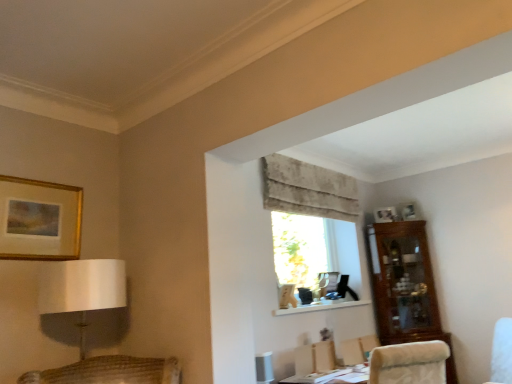
At what (x,y) coordinates should I click in order to perform the action: click on matte silver picture frame at upper right, marked as the 2th picture frame in a front-to-back arrangement. Please return your answer as a coordinate pair (x, y). This screenshot has height=384, width=512. Looking at the image, I should click on (385, 214).

Locate an element on the screen. The height and width of the screenshot is (384, 512). translucent fabric window at center is located at coordinates (298, 249).

This screenshot has height=384, width=512. What are the coordinates of `white glossy picture frame at upper right, the first picture frame positioned from the back` in the screenshot? It's located at (407, 211).

At what (x,y) coordinates should I click in order to perform the action: click on matte silver picture frame at upper right, marked as the 2th picture frame in a front-to-back arrangement. Please return your answer as a coordinate pair (x, y). Looking at the image, I should click on (385, 214).

Which is more to the left, velvet beige armchair at lower right or translucent fabric window at center?

From the viewer's perspective, translucent fabric window at center appears more on the left side.

Can you confirm if velvet beige armchair at lower right is smaller than translucent fabric window at center?

Yes.

Can you confirm if velvet beige armchair at lower right is wider than translucent fabric window at center?

Incorrect, the width of velvet beige armchair at lower right does not surpass that of translucent fabric window at center.

Can translucent fabric window at center be found inside velvet beige armchair at lower right?

No, translucent fabric window at center is not surrounded by velvet beige armchair at lower right.

How different are the orientations of gold/glossy picture frame at upper left, marked as the 1th picture frame in a left-to-right arrangement, and matte silver picture frame at upper right, which ranks as the second picture frame in back-to-front order, in degrees?

39.9 degrees.

Which is closer to the camera, (19, 255) or (384, 222)?

The point (19, 255) is closer.

How much distance is there between gold/glossy picture frame at upper left, which is the third picture frame from right to left, and matte silver picture frame at upper right, arranged as the second picture frame when viewed from the left?

A distance of 9.36 feet exists between gold/glossy picture frame at upper left, which is the third picture frame from right to left, and matte silver picture frame at upper right, arranged as the second picture frame when viewed from the left.

From a real-world perspective, is gold/glossy picture frame at upper left, which appears as the 1th picture frame when viewed from the front, over matte silver picture frame at upper right, arranged as the second picture frame when viewed from the left?

Actually, gold/glossy picture frame at upper left, which appears as the 1th picture frame when viewed from the front, is physically below matte silver picture frame at upper right, arranged as the second picture frame when viewed from the left, in the real world.

Could you tell me if velvet beige armchair at lower right is facing beige textured curtain at upper center?

No, velvet beige armchair at lower right is not facing towards beige textured curtain at upper center.

From a real-world perspective, is velvet beige armchair at lower right positioned over beige textured curtain at upper center based on gravity?

No, from a real-world perspective, velvet beige armchair at lower right is not above beige textured curtain at upper center.

Is velvet beige armchair at lower right to the left of beige textured curtain at upper center from the viewer's perspective?

Incorrect, velvet beige armchair at lower right is not on the left side of beige textured curtain at upper center.

Where is `curtain above the velvet beige armchair at lower right (from a real-world perspective)`? Image resolution: width=512 pixels, height=384 pixels. curtain above the velvet beige armchair at lower right (from a real-world perspective) is located at coordinates (308, 189).

Based on the photo, considering the sizes of translucent fabric window at center and beige textured curtain at upper center in the image, is translucent fabric window at center wider or thinner than beige textured curtain at upper center?

In the image, translucent fabric window at center appears to be more narrow than beige textured curtain at upper center.

Where is `window below the beige textured curtain at upper center (from the image's perspective)`? window below the beige textured curtain at upper center (from the image's perspective) is located at coordinates (298, 249).

Is translucent fabric window at center next to beige textured curtain at upper center?

No, translucent fabric window at center is not beside beige textured curtain at upper center.

How far apart are white matte shelf at center and matte silver picture frame at upper right, which ranks as the second picture frame in back-to-front order?

They are 3.38 feet apart.

Does white matte shelf at center turn towards matte silver picture frame at upper right, arranged as the second picture frame when viewed from the left?

No.

Is white matte shelf at center inside the boundaries of matte silver picture frame at upper right, marked as the 2th picture frame in a front-to-back arrangement, or outside?

white matte shelf at center lies outside matte silver picture frame at upper right, marked as the 2th picture frame in a front-to-back arrangement.

Is white matte shelf at center behind matte silver picture frame at upper right, marked as the 2th picture frame in a front-to-back arrangement?

No, white matte shelf at center is closer to the camera.

Is gold/glossy picture frame at upper left, which appears as the 1th picture frame when viewed from the front, positioned with its back to white matte shelf at center?

No, gold/glossy picture frame at upper left, which appears as the 1th picture frame when viewed from the front,'s orientation is not away from white matte shelf at center.

Is gold/glossy picture frame at upper left, which appears as the 1th picture frame when viewed from the front, positioned behind white matte shelf at center?

That is False.

From the image's perspective, is gold/glossy picture frame at upper left, which appears as the 1th picture frame when viewed from the front, positioned above or below white matte shelf at center?

From the image's perspective, gold/glossy picture frame at upper left, which appears as the 1th picture frame when viewed from the front, appears above white matte shelf at center.

I want to click on shelf below the gold/glossy picture frame at upper left, marked as the 1th picture frame in a left-to-right arrangement (from the image's perspective), so click(x=319, y=307).

Based on the photo, considering the relative sizes of gold/glossy picture frame at upper left, marked as the 1th picture frame in a left-to-right arrangement, and beige textured curtain at upper center in the image provided, is gold/glossy picture frame at upper left, marked as the 1th picture frame in a left-to-right arrangement, taller than beige textured curtain at upper center?

Indeed, gold/glossy picture frame at upper left, marked as the 1th picture frame in a left-to-right arrangement, has a greater height compared to beige textured curtain at upper center.

Is gold/glossy picture frame at upper left, which is the third picture frame from right to left, thinner than beige textured curtain at upper center?

Yes.

Visually, is gold/glossy picture frame at upper left, which is the third picture frame from right to left, positioned to the left or to the right of beige textured curtain at upper center?

From the image, it's evident that gold/glossy picture frame at upper left, which is the third picture frame from right to left, is to the left of beige textured curtain at upper center.

From a real-world perspective, who is located lower, gold/glossy picture frame at upper left, marked as the 1th picture frame in a left-to-right arrangement, or beige textured curtain at upper center?

In real-world perspective, gold/glossy picture frame at upper left, marked as the 1th picture frame in a left-to-right arrangement, is lower.

Locate an element on the screen. Image resolution: width=512 pixels, height=384 pixels. armchair below the translucent fabric window at center (from the image's perspective) is located at coordinates (358, 349).

From the gold/glossy picture frame at upper left, which is the 3th picture frame from back to front, count 1st picture frame to the right and point to it. Please provide its 2D coordinates.

[(385, 214)]

From the image, which object appears to be farther from gold/glossy picture frame at upper left, marked as the 1th picture frame in a left-to-right arrangement, translucent fabric window at center or white matte shelf at center?

The object further to gold/glossy picture frame at upper left, marked as the 1th picture frame in a left-to-right arrangement, is translucent fabric window at center.

Looking at the image, which one is located further to gold/glossy picture frame at upper left, marked as the 1th picture frame in a left-to-right arrangement, white glossy picture frame at upper right, arranged as the third picture frame when viewed from the left, or translucent fabric window at center?

white glossy picture frame at upper right, arranged as the third picture frame when viewed from the left, lies further to gold/glossy picture frame at upper left, marked as the 1th picture frame in a left-to-right arrangement, than the other object.

Which object lies nearer to the anchor point white glossy picture frame at upper right, the first picture frame positioned from the back, velvet beige armchair at lower right or gold/glossy picture frame at upper left, which appears as the 1th picture frame when viewed from the front?

Among the two, velvet beige armchair at lower right is located nearer to white glossy picture frame at upper right, the first picture frame positioned from the back.

Based on their spatial positions, is white matte shelf at center or velvet beige armchair at lower right further from matte silver picture frame at upper right, marked as the 2th picture frame in a front-to-back arrangement?

velvet beige armchair at lower right is further to matte silver picture frame at upper right, marked as the 2th picture frame in a front-to-back arrangement.

Considering their positions, is white matte shelf at center positioned further to matte silver picture frame at upper right, which ranks as the second picture frame in back-to-front order, than white glossy picture frame at upper right, the first picture frame positioned from the back?

Among the two, white matte shelf at center is located further to matte silver picture frame at upper right, which ranks as the second picture frame in back-to-front order.

Considering their positions, is velvet beige armchair at lower right positioned closer to white matte shelf at center than beige textured curtain at upper center?

Based on the image, velvet beige armchair at lower right appears to be nearer to white matte shelf at center.

Based on their spatial positions, is velvet beige armchair at lower right or beige textured curtain at upper center further from translucent fabric window at center?

Based on the image, velvet beige armchair at lower right appears to be further to translucent fabric window at center.

Which object lies nearer to the anchor point velvet beige armchair at lower right, translucent fabric window at center or matte silver picture frame at upper right, marked as the 2th picture frame in a right-to-left arrangement?

translucent fabric window at center.

This screenshot has width=512, height=384. Identify the location of picture frame located between beige textured curtain at upper center and white glossy picture frame at upper right, positioned as the third picture frame in front-to-back order, in the depth direction. pyautogui.click(x=385, y=214).

You are a GUI agent. You are given a task and a screenshot of the screen. Output one action in this format:
    pyautogui.click(x=<x>, y=<y>)
    Task: Click on the armchair located between gold/glossy picture frame at upper left, marked as the 1th picture frame in a left-to-right arrangement, and white glossy picture frame at upper right, positioned as the third picture frame in front-to-back order, in the left-right direction
    This screenshot has width=512, height=384.
    Given the screenshot: What is the action you would take?
    coord(358,349)

Image resolution: width=512 pixels, height=384 pixels. What are the coordinates of `window located between gold/glossy picture frame at upper left, which is the third picture frame from right to left, and white glossy picture frame at upper right, the first picture frame positioned from the back, in the left-right direction` in the screenshot? It's located at (298, 249).

Locate an element on the screen. The image size is (512, 384). picture frame located between translucent fabric window at center and white glossy picture frame at upper right, positioned as the third picture frame in front-to-back order, in the left-right direction is located at coordinates (385, 214).